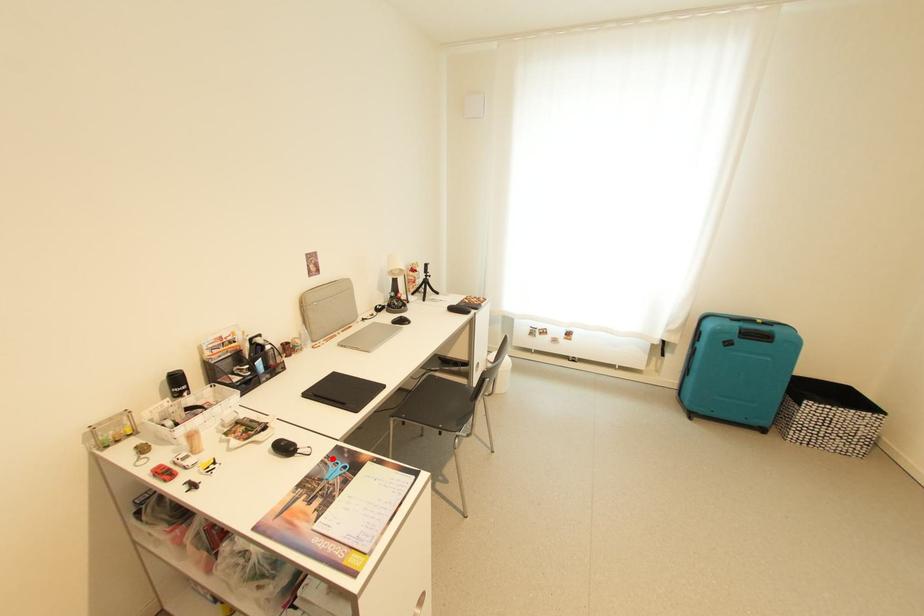
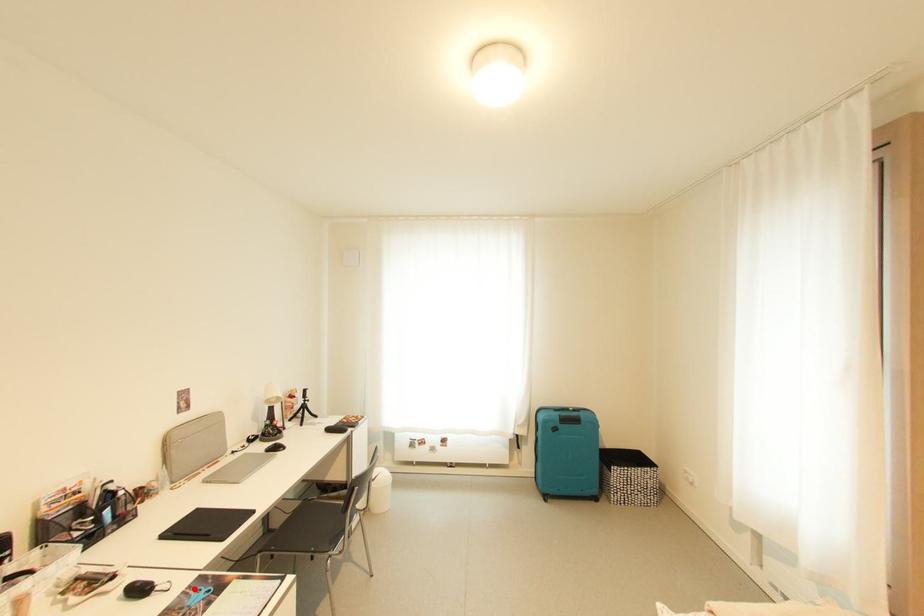
Consider the image. I am providing you with two images of the same scene from different viewpoints. A red point is marked on the first image and another point is marked on the second image. Are the points marked in image1 and image2 representing the same 3D position?

Yes